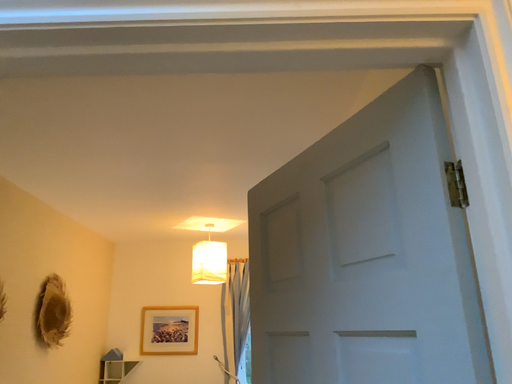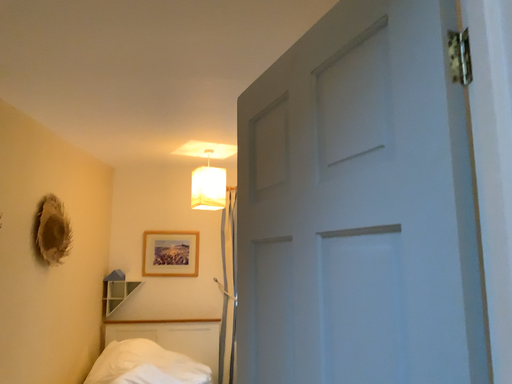
Question: How did the camera likely rotate when shooting the video?

Choices:
 (A) rotated downward
 (B) rotated upward

Answer: (A)